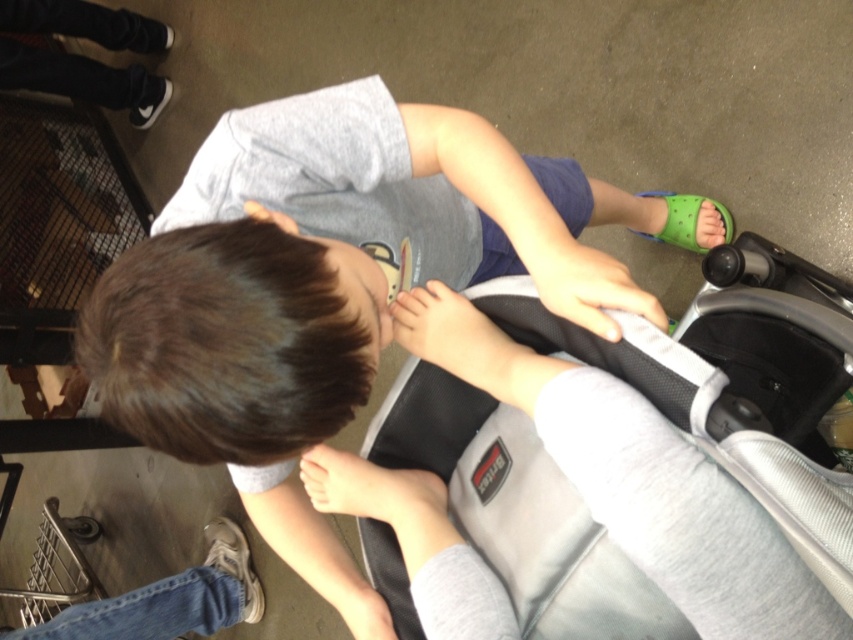
Question: Does gray mesh baby carriage at center lie in front of gray fabric shirt at center?

Choices:
 (A) no
 (B) yes

Answer: (B)

Question: Which point is closer to the camera?

Choices:
 (A) (396, 104)
 (B) (560, 456)

Answer: (B)

Question: Which of the following is the farthest from the observer?

Choices:
 (A) (410, 188)
 (B) (708, 424)

Answer: (A)

Question: In this image, where is gray mesh baby carriage at center located relative to gray fabric shirt at center?

Choices:
 (A) right
 (B) left

Answer: (A)

Question: Is gray mesh baby carriage at center further to camera compared to gray fabric shirt at center?

Choices:
 (A) yes
 (B) no

Answer: (B)